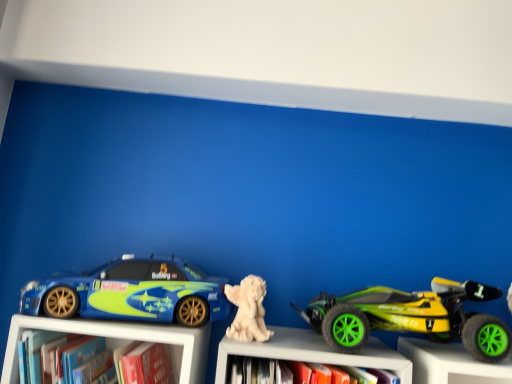
Question: Considering the relative sizes of white matte statue at center and hardcover book at lower left in the image provided, is white matte statue at center thinner than hardcover book at lower left?

Choices:
 (A) yes
 (B) no

Answer: (B)

Question: Is there a large distance between white matte statue at center and hardcover book at lower left?

Choices:
 (A) no
 (B) yes

Answer: (A)

Question: Is hardcover book at lower left surrounded by white matte statue at center?

Choices:
 (A) no
 (B) yes

Answer: (A)

Question: Does white matte statue at center have a smaller size compared to hardcover book at lower left?

Choices:
 (A) no
 (B) yes

Answer: (A)

Question: Can you confirm if white matte statue at center is bigger than hardcover book at lower left?

Choices:
 (A) no
 (B) yes

Answer: (B)

Question: From the image's perspective, is white matte statue at center, the 2th toy when ordered from right to left, located above or below green rubber toy car at right, positioned as the 1th toy in right-to-left order?

Choices:
 (A) above
 (B) below

Answer: (A)

Question: Considering the positions of white matte statue at center, which appears as the 1th toy when viewed from the left, and green rubber toy car at right, the 2th toy from the left, in the image, is white matte statue at center, which appears as the 1th toy when viewed from the left, taller or shorter than green rubber toy car at right, the 2th toy from the left,?

Choices:
 (A) short
 (B) tall

Answer: (A)

Question: In the image, is white matte statue at center, which appears as the 1th toy when viewed from the left, on the left side or the right side of green rubber toy car at right, the 2th toy from the left?

Choices:
 (A) right
 (B) left

Answer: (B)

Question: Would you say white matte statue at center, the 2th toy when ordered from right to left, is inside or outside green rubber toy car at right, the 2th toy from the left?

Choices:
 (A) outside
 (B) inside

Answer: (A)

Question: Is point (42, 369) closer or farther from the camera than point (471, 336)?

Choices:
 (A) farther
 (B) closer

Answer: (B)

Question: From a real-world perspective, is hardcover book at lower left above or below green rubber toy car at right, positioned as the 1th toy in right-to-left order?

Choices:
 (A) above
 (B) below

Answer: (B)

Question: Looking at the image, does hardcover book at lower left seem bigger or smaller compared to green rubber toy car at right, positioned as the 1th toy in right-to-left order?

Choices:
 (A) small
 (B) big

Answer: (A)

Question: Is hardcover book at lower left in front of or behind green rubber toy car at right, the 2th toy from the left, in the image?

Choices:
 (A) behind
 (B) front

Answer: (B)

Question: Based on their positions, is white matte statue at center, which appears as the 1th toy when viewed from the left, located to the left or right of hardcover book at lower left?

Choices:
 (A) left
 (B) right

Answer: (B)

Question: Is white matte statue at center, the 2th toy when ordered from right to left, bigger or smaller than hardcover book at lower left?

Choices:
 (A) big
 (B) small

Answer: (B)